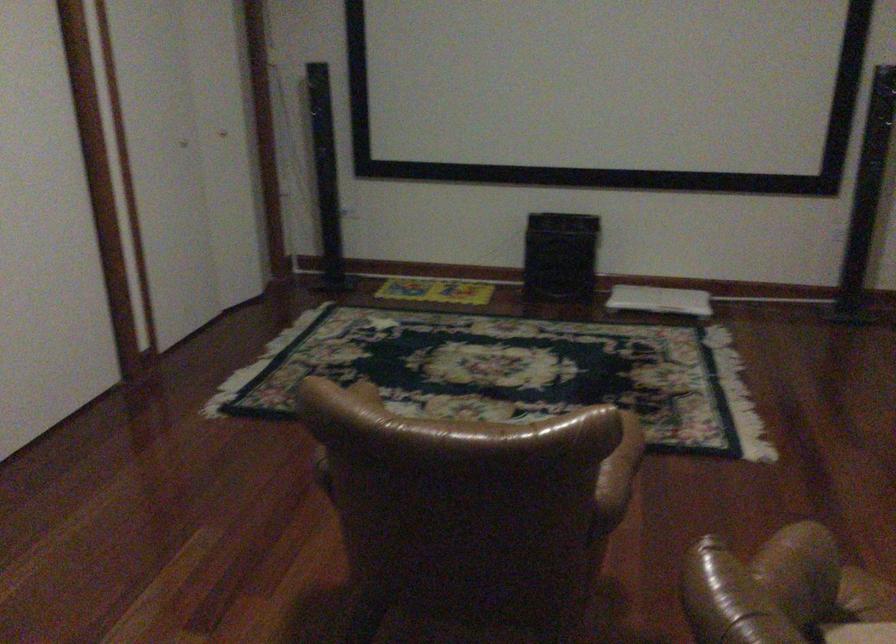
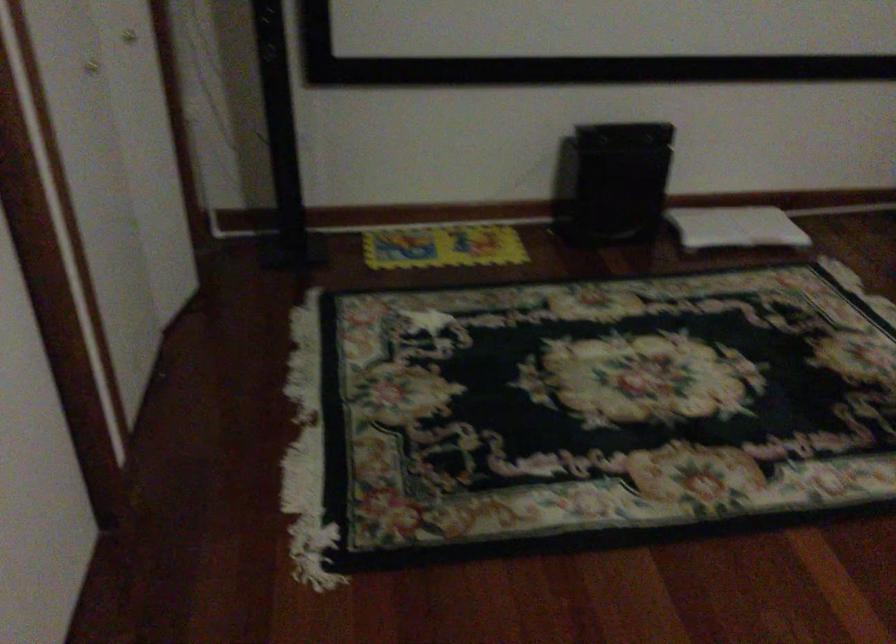
Which direction would the cameraman need to move to produce the second image?

The movement direction of the cameraman is left, forward.